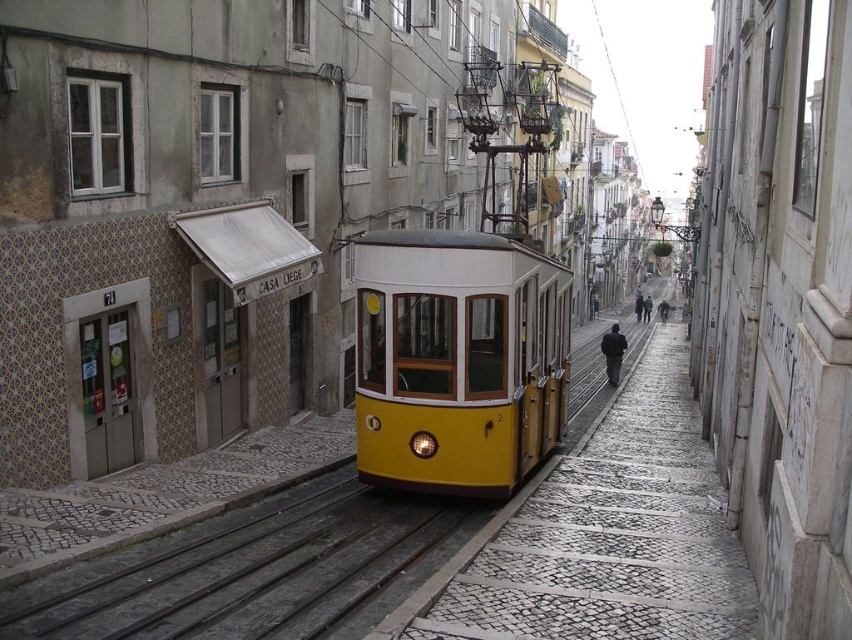
Describe the element at coordinates (458, 358) in the screenshot. This screenshot has height=640, width=852. I see `yellow matte cable car at center` at that location.

Based on the photo, who is taller, yellow matte cable car at center or metallic gray train track at center?

Standing taller between the two is yellow matte cable car at center.

Between point (361, 419) and point (289, 525), which one is positioned in front?

Positioned in front is point (289, 525).

I want to click on yellow matte cable car at center, so click(x=458, y=358).